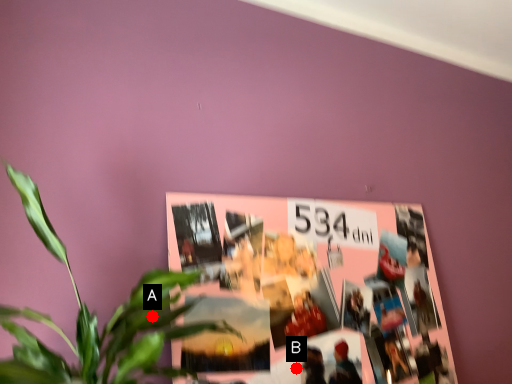
Question: Two points are circled on the image, labeled by A and B beside each circle. Which point appears farthest from the camera in this image?

Choices:
 (A) A is further
 (B) B is further

Answer: (B)